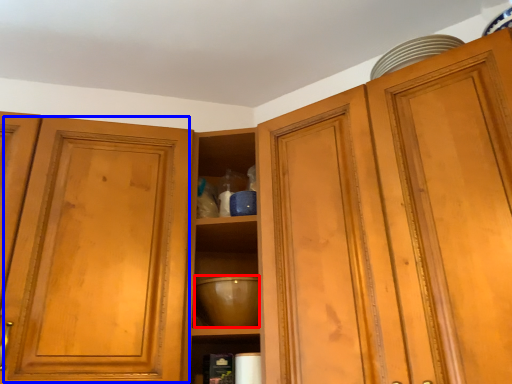
Question: Among these objects, which one is nearest to the camera, mixing bowl (highlighted by a red box) or glass door (highlighted by a blue box)?

Choices:
 (A) mixing bowl
 (B) glass door

Answer: (B)